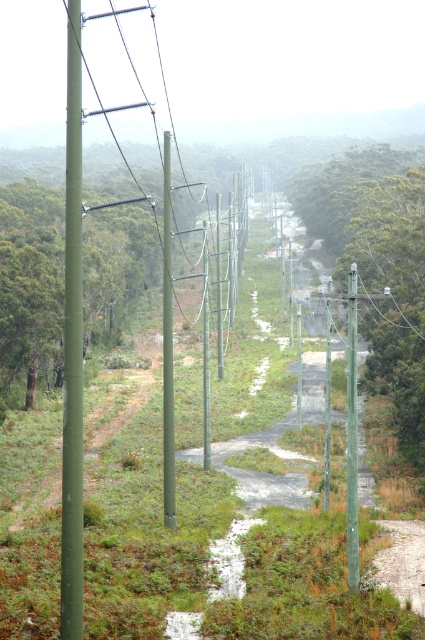
Question: In this image, where is green matte pole at center located relative to green painted wood telegraph pole at center?

Choices:
 (A) below
 (B) above

Answer: (B)

Question: Is green textured pole at center smaller than green matte pole at center?

Choices:
 (A) yes
 (B) no

Answer: (B)

Question: Is green matte pole at left to the left of green matte pole at center from the viewer's perspective?

Choices:
 (A) no
 (B) yes

Answer: (B)

Question: Among these points, which one is farthest from the camera?

Choices:
 (A) (357, 452)
 (B) (79, 48)
 (C) (167, 456)

Answer: (C)

Question: Which of the following is the farthest from the observer?

Choices:
 (A) (351, 291)
 (B) (166, 248)
 (C) (337, 202)

Answer: (C)

Question: Which point is closer to the camera?

Choices:
 (A) (167, 170)
 (B) (71, 300)
 (C) (5, 310)

Answer: (B)